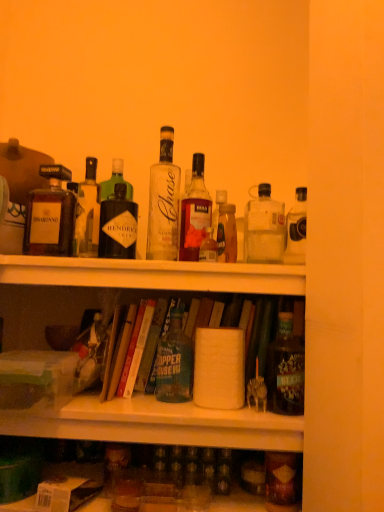
Question: From a real-world perspective, is translucent glass bottle at center, which is the fourth bottle from right to left, positioned under matte brown bottle at left, arranged as the ninth bottle when viewed from the right, based on gravity?

Choices:
 (A) no
 (B) yes

Answer: (B)

Question: Is translucent glass bottle at center, which is the fourth bottle from right to left, in contact with matte brown bottle at left, arranged as the ninth bottle when viewed from the right?

Choices:
 (A) no
 (B) yes

Answer: (A)

Question: Is translucent glass bottle at center, which is the sixth bottle from left to right, turned away from matte brown bottle at left, which ranks as the 1th bottle in left-to-right order?

Choices:
 (A) no
 (B) yes

Answer: (A)

Question: From the image's perspective, is translucent glass bottle at center, which is the sixth bottle from left to right, located beneath matte brown bottle at left, arranged as the ninth bottle when viewed from the right?

Choices:
 (A) no
 (B) yes

Answer: (B)

Question: Is translucent glass bottle at center, which is the fourth bottle from right to left, thinner than matte brown bottle at left, which ranks as the 1th bottle in left-to-right order?

Choices:
 (A) no
 (B) yes

Answer: (B)

Question: Does translucent glass bottle at center, which is the fourth bottle from right to left, lie in front of matte brown bottle at left, arranged as the ninth bottle when viewed from the right?

Choices:
 (A) yes
 (B) no

Answer: (A)

Question: From the image's perspective, would you say matte brown bottle at lower right, the 2th bottle from the right, is shown under green matte bottle at center, which is counted as the 4th bottle, starting from the left?

Choices:
 (A) yes
 (B) no

Answer: (A)

Question: Is matte brown bottle at lower right, the 2th bottle from the right, oriented towards green matte bottle at center, marked as the 6th bottle in a right-to-left arrangement?

Choices:
 (A) no
 (B) yes

Answer: (A)

Question: From a real-world perspective, does matte brown bottle at lower right, acting as the 8th bottle starting from the left, stand above green matte bottle at center, which is counted as the 4th bottle, starting from the left?

Choices:
 (A) no
 (B) yes

Answer: (A)

Question: Does matte brown bottle at lower right, acting as the 8th bottle starting from the left, appear on the left side of green matte bottle at center, which is counted as the 4th bottle, starting from the left?

Choices:
 (A) no
 (B) yes

Answer: (A)

Question: Does matte brown bottle at lower right, acting as the 8th bottle starting from the left, have a larger size compared to green matte bottle at center, marked as the 6th bottle in a right-to-left arrangement?

Choices:
 (A) yes
 (B) no

Answer: (B)

Question: Is matte brown bottle at lower right, acting as the 8th bottle starting from the left, at the right side of green matte bottle at center, which is counted as the 4th bottle, starting from the left?

Choices:
 (A) no
 (B) yes

Answer: (B)

Question: Considering the relative sizes of matte black bottle at right, which ranks as the 9th bottle in left-to-right order, and translucent glass bottle at center, which is the fourth bottle from right to left, in the image provided, is matte black bottle at right, which ranks as the 9th bottle in left-to-right order, smaller than translucent glass bottle at center, which is the fourth bottle from right to left,?

Choices:
 (A) yes
 (B) no

Answer: (B)